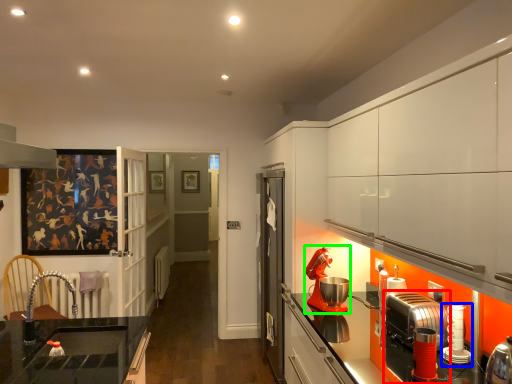
Question: Considering the real-world distances, which object is farthest from kitchen appliance (highlighted by a red box)? kitchen appliance (highlighted by a blue box) or kitchen appliance (highlighted by a green box)?

Choices:
 (A) kitchen appliance
 (B) kitchen appliance

Answer: (B)